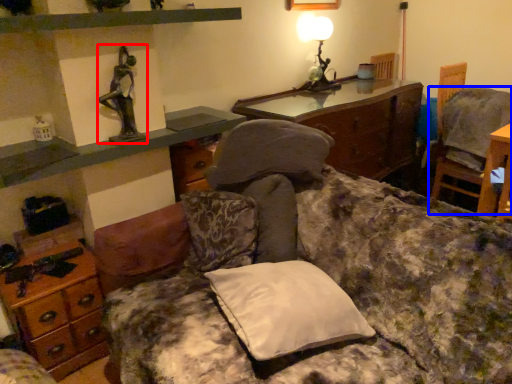
Question: Which point is further to the camera, person (highlighted by a red box) or chair (highlighted by a blue box)?

Choices:
 (A) person
 (B) chair

Answer: (B)